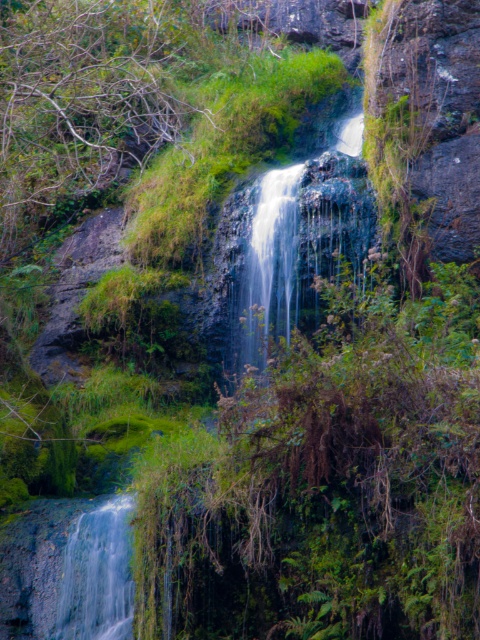
Question: Among these points, which one is farthest from the camera?

Choices:
 (A) (72, 588)
 (B) (219, 228)

Answer: (B)

Question: Can you confirm if translucent glass waterfall at center is thinner than clear water at bottom left?

Choices:
 (A) no
 (B) yes

Answer: (A)

Question: Considering the relative positions of translucent glass waterfall at center and clear water at bottom left in the image provided, where is translucent glass waterfall at center located with respect to clear water at bottom left?

Choices:
 (A) left
 (B) right

Answer: (B)

Question: Which object is farther from the camera taking this photo?

Choices:
 (A) clear water at bottom left
 (B) translucent glass waterfall at center

Answer: (B)

Question: Is translucent glass waterfall at center closer to camera compared to clear water at bottom left?

Choices:
 (A) yes
 (B) no

Answer: (B)